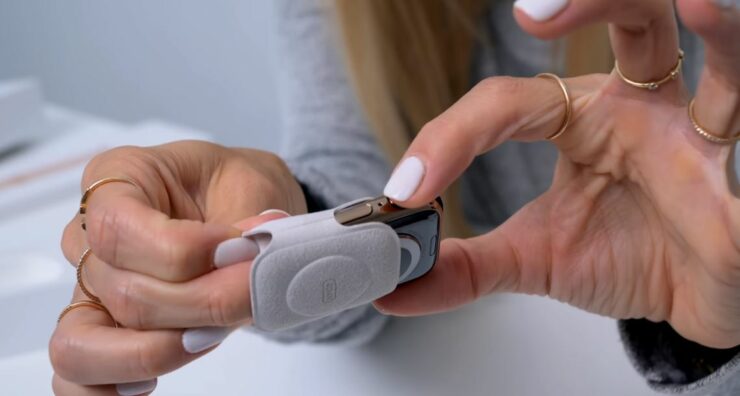
The height and width of the screenshot is (396, 740). In order to click on table in this screenshot , I will do `click(530, 369)`.